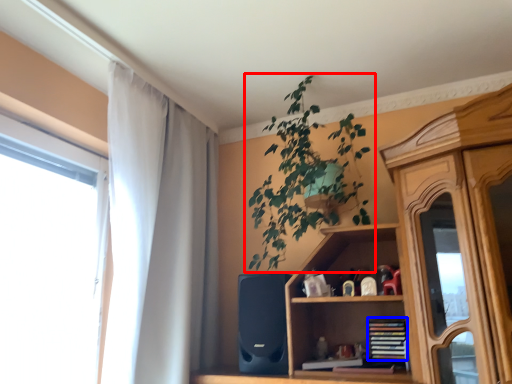
Question: Among these objects, which one is farthest to the camera, houseplant (highlighted by a red box) or book (highlighted by a blue box)?

Choices:
 (A) houseplant
 (B) book

Answer: (B)